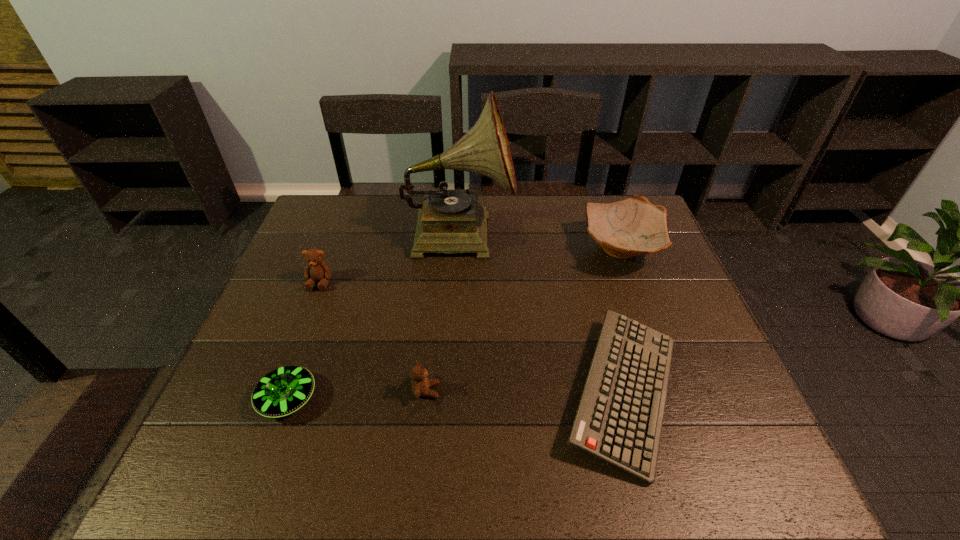
This screenshot has width=960, height=540. Find the location of `the tallest object`. the tallest object is located at coordinates (449, 221).

This screenshot has width=960, height=540. I want to click on pottery, so click(x=634, y=226).

Find the location of a particular element. the left teddy bear is located at coordinates (317, 270).

The image size is (960, 540). I want to click on the nearer teddy bear, so click(420, 385).

Find the location of a particular element. The image size is (960, 540). saucer is located at coordinates (284, 390).

Locate an element on the screen. the shortest object is located at coordinates (619, 419).

Find the location of a particular element. This screenshot has width=960, height=540. vacant position located 0.050m from the horn of the record player is located at coordinates (530, 233).

Where is `vacant space located 0.170m on the left of the pottery`? The width and height of the screenshot is (960, 540). vacant space located 0.170m on the left of the pottery is located at coordinates (526, 249).

Where is `vacant space located on the face of the farther teddy bear`? The image size is (960, 540). vacant space located on the face of the farther teddy bear is located at coordinates (285, 372).

Locate an element on the screen. blank space located at the face of the nearer teddy bear is located at coordinates (566, 390).